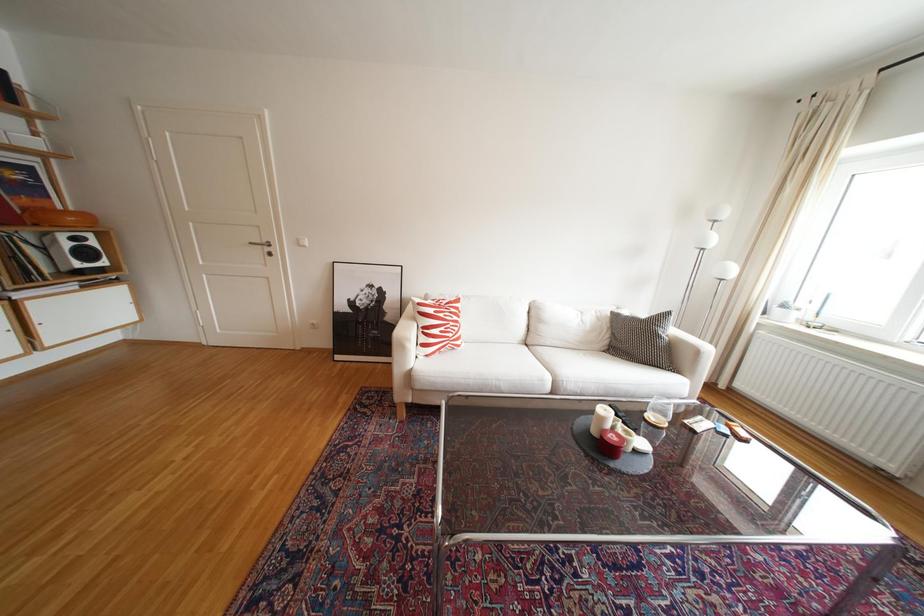
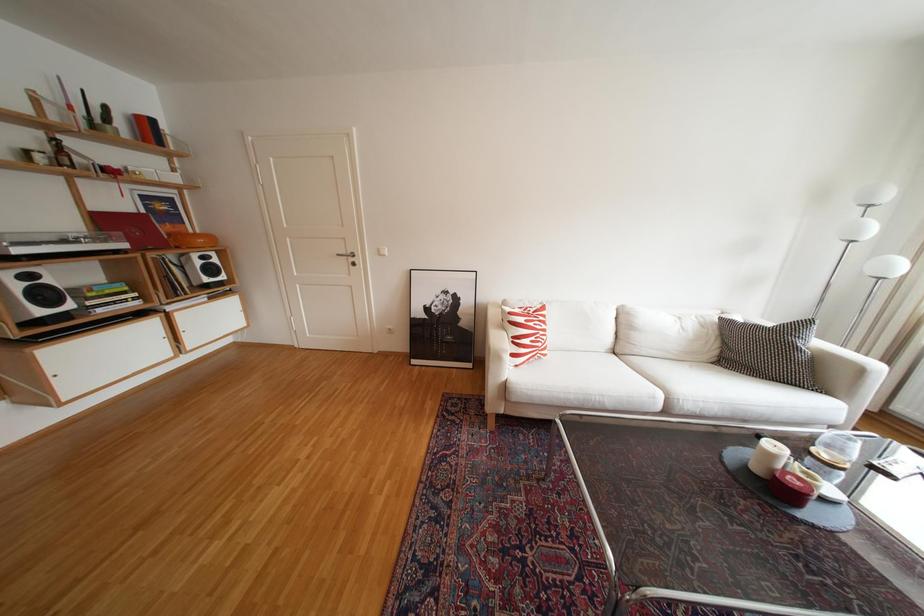
Question: Based on the continuous images, in which direction is the camera rotating? Reply with the corresponding letter.

Choices:
 (A) Left
 (B) Right
 (C) Up
 (D) Down

Answer: (A)